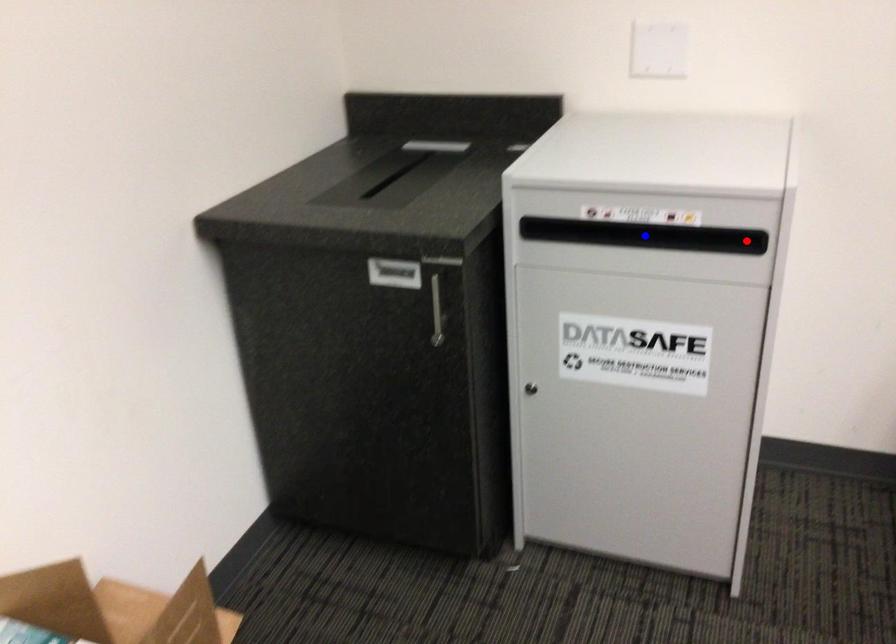
Question: Which of the two points in the image is closer to the camera?

Choices:
 (A) Blue point is closer.
 (B) Red point is closer.

Answer: (B)